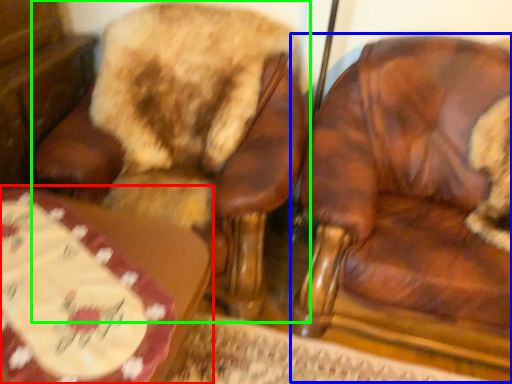
Question: Considering the real-world distances, which object is closest to table (highlighted by a red box)? chair (highlighted by a blue box) or chair (highlighted by a green box).

Choices:
 (A) chair
 (B) chair

Answer: (B)